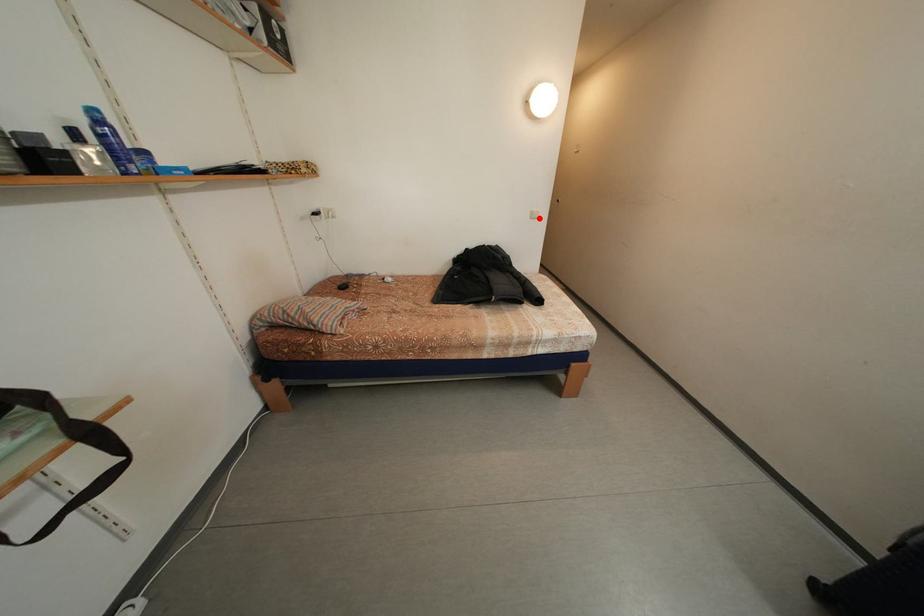
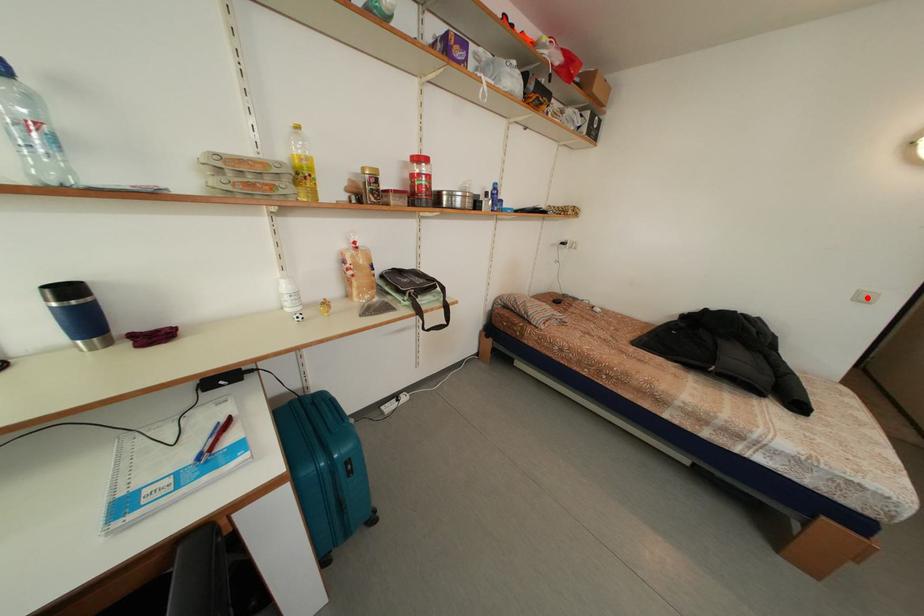
I am providing you with two images of the same scene from different viewpoints. A red point is marked on the first image and another point is marked on the second image. Do the highlighted points in image1 and image2 indicate the same real-world spot?

Yes